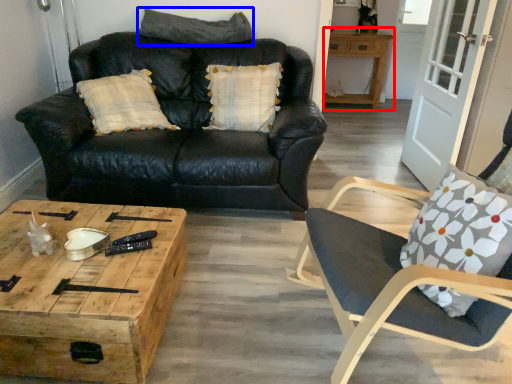
Question: Which point is further to the camera, table (highlighted by a red box) or pillow (highlighted by a blue box)?

Choices:
 (A) table
 (B) pillow

Answer: (A)